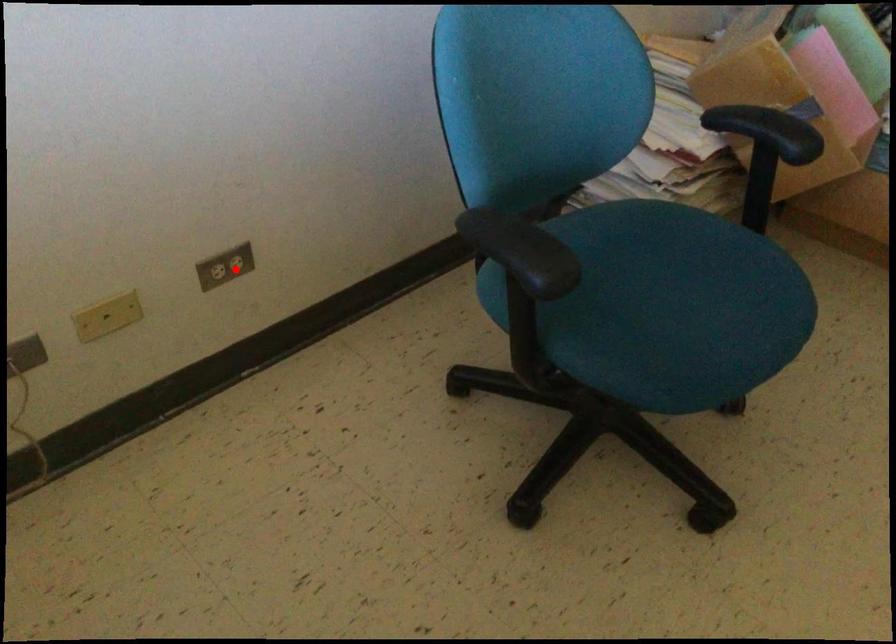
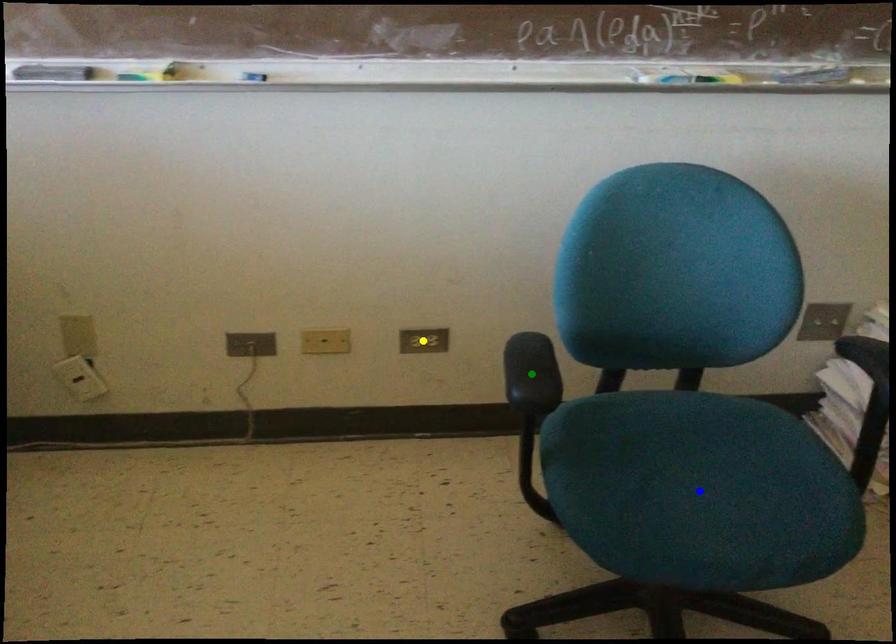
Question: I am providing you with two images of the same scene from different viewpoints. A red point is marked on the first image. You are given multiple points on the second image. Which mark in image 2 goes with the point in image 1?

Choices:
 (A) green point
 (B) blue point
 (C) yellow point

Answer: (C)